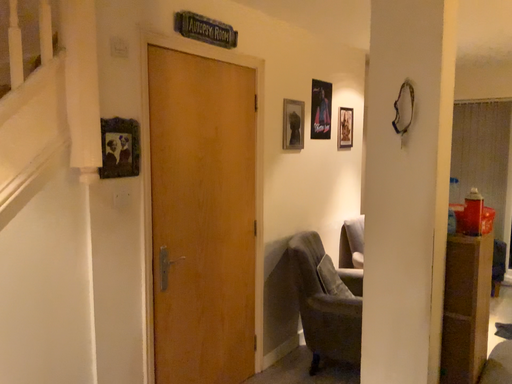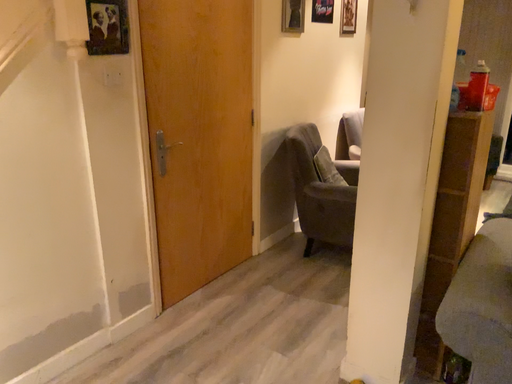
Question: Which way did the camera rotate in the video?

Choices:
 (A) rotated upward
 (B) rotated downward

Answer: (B)